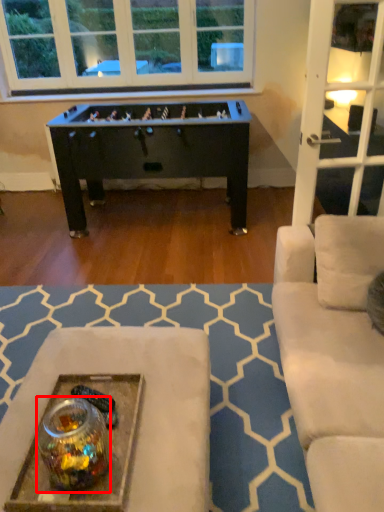
Question: Considering the relative positions of glass jar (annotated by the red box) and table in the image provided, where is glass jar (annotated by the red box) located with respect to the staircase?

Choices:
 (A) right
 (B) left

Answer: (A)